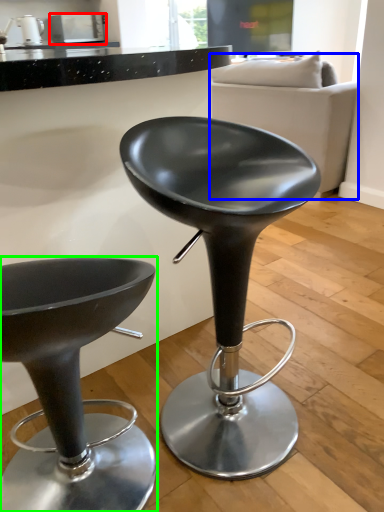
Question: Which object is the farthest from appliance (highlighted by a red box)? Choose among these: couch (highlighted by a blue box) or chair (highlighted by a green box).

Choices:
 (A) couch
 (B) chair

Answer: (B)